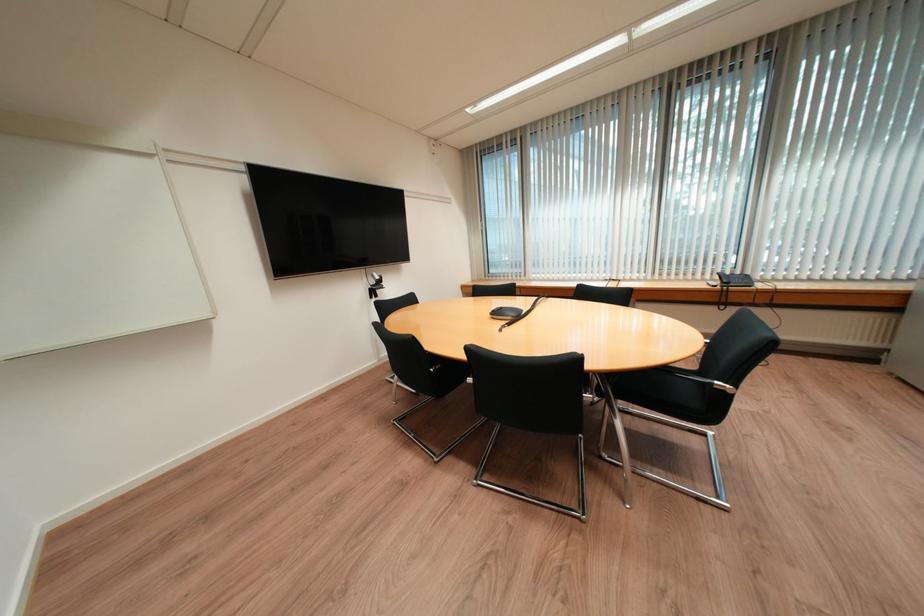
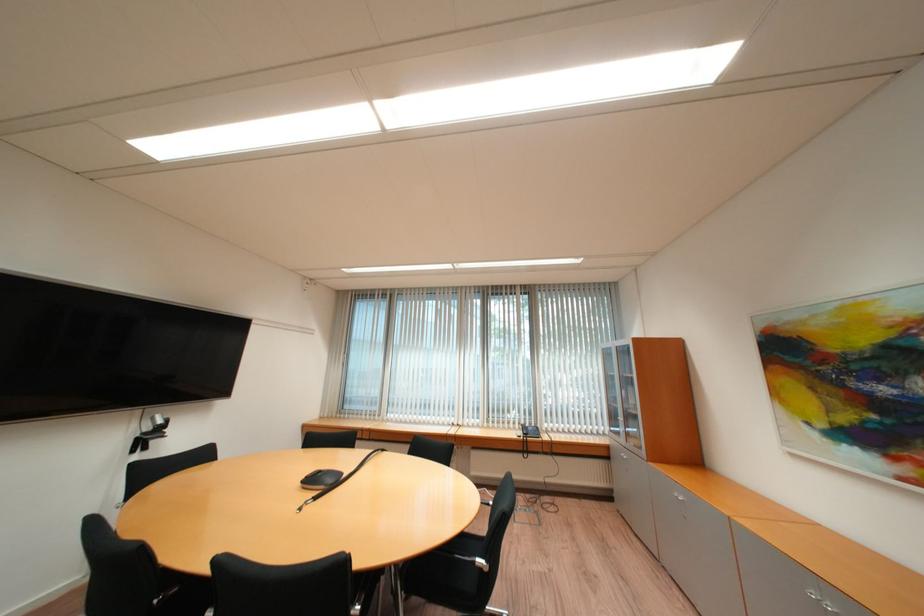
The point at (725, 384) is marked in the first image. Where is the corresponding point in the second image?

(487, 561)